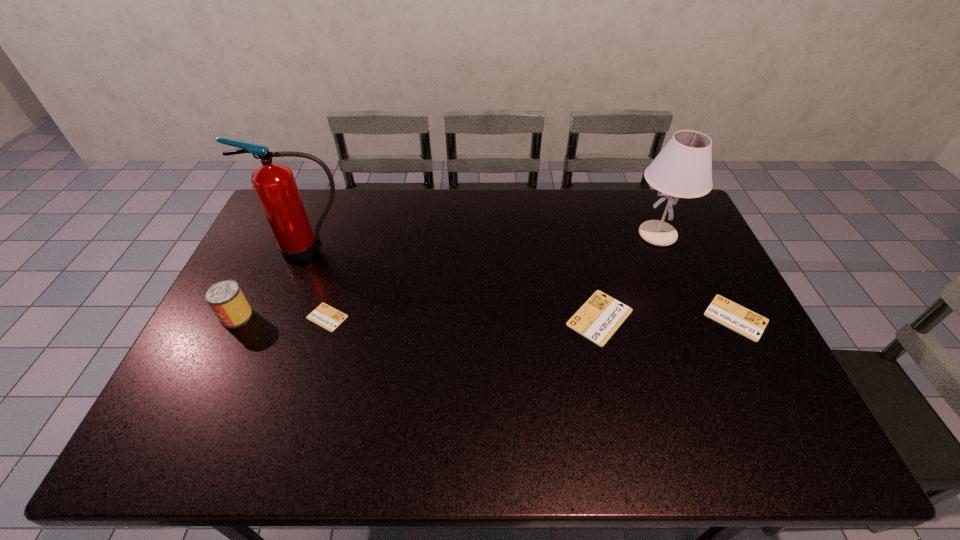
The image size is (960, 540). Find the location of `free space at the far edge of the desktop`. free space at the far edge of the desktop is located at coordinates (517, 199).

Where is `vacant area at the near edge of the desktop`? vacant area at the near edge of the desktop is located at coordinates (276, 382).

Image resolution: width=960 pixels, height=540 pixels. Identify the location of blank space at the left edge of the desktop. (241, 375).

The width and height of the screenshot is (960, 540). What are the coordinates of `free space at the right edge` in the screenshot? It's located at (681, 262).

The width and height of the screenshot is (960, 540). I want to click on free point between the lampshade and the can, so click(447, 276).

Identify the location of vacant area that lies between the rightmost identity card and the leftmost identity card. tap(532, 318).

Where is `vacant area that lies between the second identity card from left to right and the fire extinguisher`? This screenshot has height=540, width=960. vacant area that lies between the second identity card from left to right and the fire extinguisher is located at coordinates (455, 284).

At what (x,y) coordinates should I click in order to perform the action: click on vacant space that's between the fire extinguisher and the rightmost identity card. Please return your answer as a coordinate pair (x, y). Image resolution: width=960 pixels, height=540 pixels. Looking at the image, I should click on (523, 284).

The width and height of the screenshot is (960, 540). I want to click on vacant region between the shortest object and the fire extinguisher, so click(319, 284).

You are a GUI agent. You are given a task and a screenshot of the screen. Output one action in this format:
    pyautogui.click(x=<x>, y=<y>)
    Task: Click on the vacant space in between the lampshade and the rightmost identity card
    
    Given the screenshot: What is the action you would take?
    pyautogui.click(x=697, y=276)